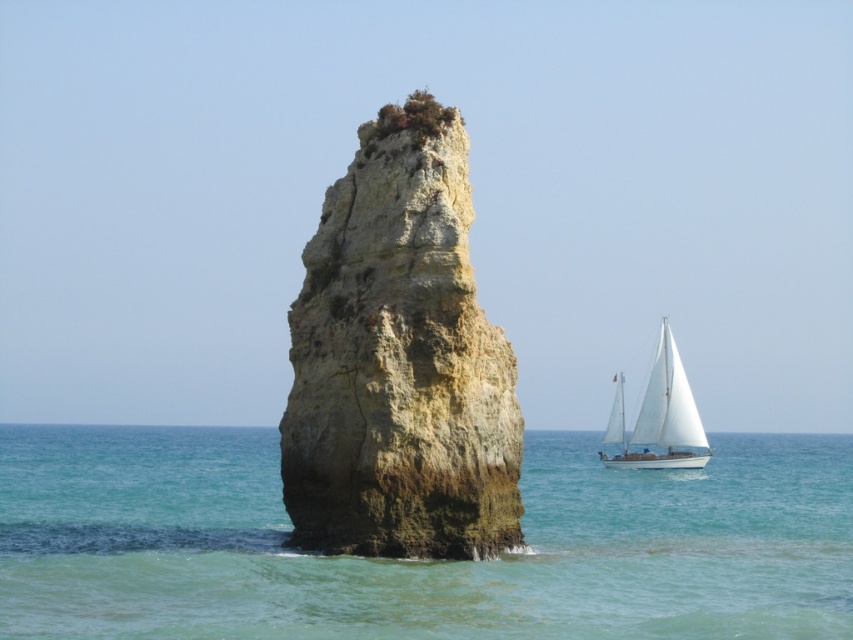
Question: Estimate the real-world distances between objects in this image. Which object is farther from the rough stone rock at center?

Choices:
 (A) white sailboat at right
 (B) clear blue water at center

Answer: (A)

Question: Which point is closer to the camera?

Choices:
 (A) white sailboat at right
 (B) clear blue water at center

Answer: (B)

Question: Is clear blue water at center bigger than rough stone rock at center?

Choices:
 (A) no
 (B) yes

Answer: (B)

Question: Estimate the real-world distances between objects in this image. Which object is closer to the clear blue water at center?

Choices:
 (A) rough stone rock at center
 (B) white sailboat at right

Answer: (A)

Question: Can you confirm if clear blue water at center is thinner than rough stone rock at center?

Choices:
 (A) yes
 (B) no

Answer: (B)

Question: Is clear blue water at center to the left of white sailboat at right from the viewer's perspective?

Choices:
 (A) yes
 (B) no

Answer: (A)